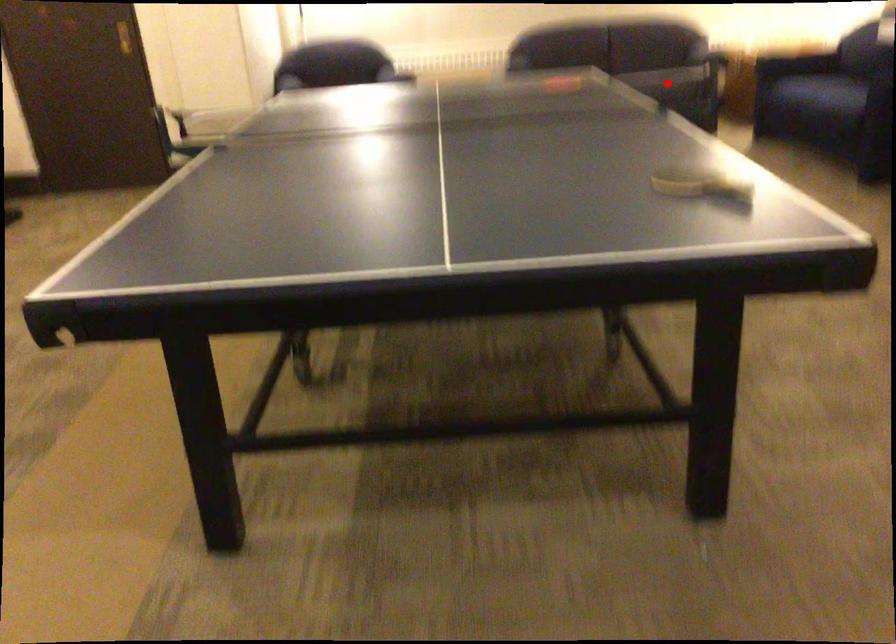
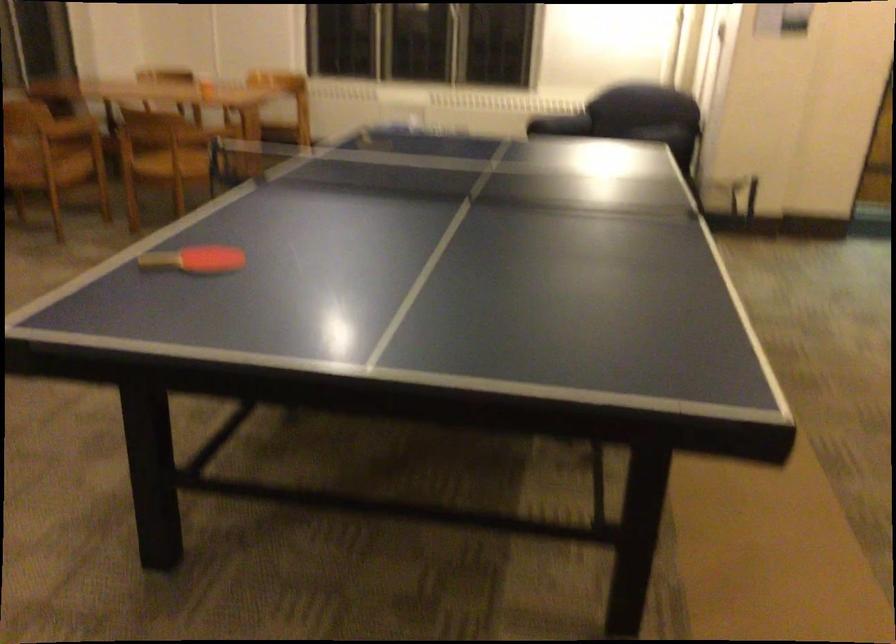
Question: I am providing you with two images of the same scene from different viewpoints. A red point is marked on the first image. At the location where the point appears in image 1, is it still visible in image 2?

Choices:
 (A) Yes
 (B) No

Answer: (B)